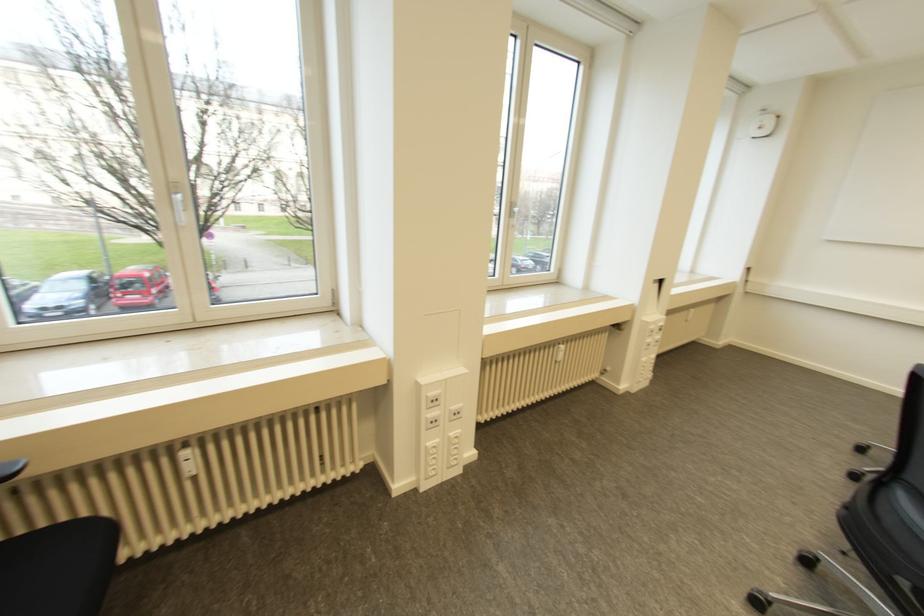
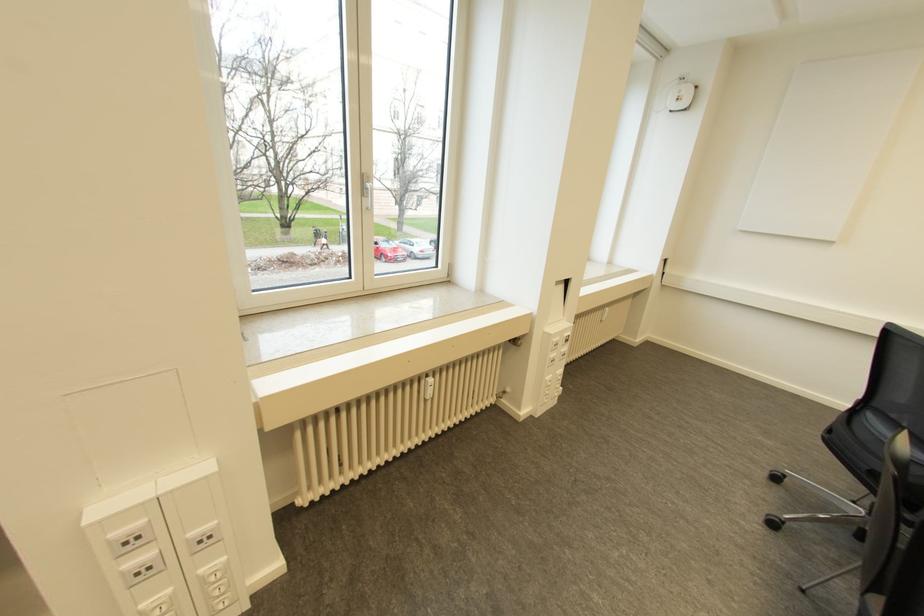
In the second image, find the point that corresponds to point 561,346 in the first image.

(430, 379)